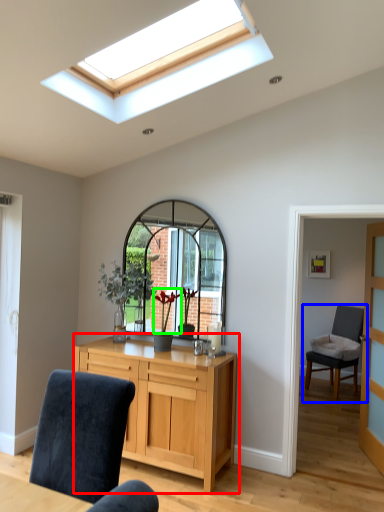
Question: Based on their relative distances, which object is farther from chest of drawers (highlighted by a red box)? Choose from chair (highlighted by a blue box) and flower (highlighted by a green box).

Choices:
 (A) chair
 (B) flower

Answer: (A)